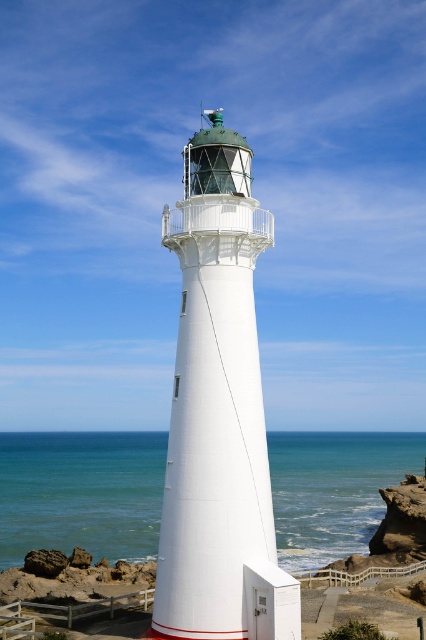
Question: Is white smooth lighthouse at center bigger than blue water at center?

Choices:
 (A) no
 (B) yes

Answer: (A)

Question: Is white smooth lighthouse at center to the right of blue water at center from the viewer's perspective?

Choices:
 (A) no
 (B) yes

Answer: (B)

Question: Which point is closer to the camera?

Choices:
 (A) (207, 237)
 (B) (417, 451)

Answer: (A)

Question: Among these points, which one is farthest from the camera?

Choices:
 (A) (178, 221)
 (B) (307, 566)

Answer: (B)

Question: Which of the following is the closest to the observer?

Choices:
 (A) blue water at center
 (B) white smooth lighthouse at center

Answer: (B)

Question: From the image, what is the correct spatial relationship of white smooth lighthouse at center in relation to blue water at center?

Choices:
 (A) above
 (B) below

Answer: (A)